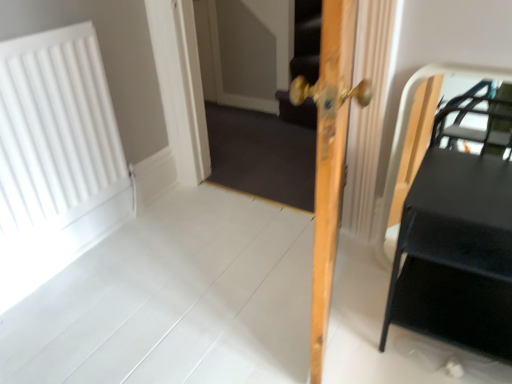
Question: Is white matte radiator at left positioned with its back to light wood door at center?

Choices:
 (A) yes
 (B) no

Answer: (B)

Question: From a real-world perspective, is white matte radiator at left over light wood door at center?

Choices:
 (A) yes
 (B) no

Answer: (B)

Question: Could you tell me if white matte radiator at left is facing light wood door at center?

Choices:
 (A) no
 (B) yes

Answer: (B)

Question: Can light wood door at center be found inside white matte radiator at left?

Choices:
 (A) yes
 (B) no

Answer: (B)

Question: From a real-world perspective, does white matte radiator at left sit lower than light wood door at center?

Choices:
 (A) yes
 (B) no

Answer: (A)

Question: Is point (204, 18) closer or farther from the camera than point (426, 183)?

Choices:
 (A) farther
 (B) closer

Answer: (A)

Question: From the image's perspective, is wooden screen door at center positioned above or below black matte table at right?

Choices:
 (A) below
 (B) above

Answer: (B)

Question: Considering the relative positions of wooden screen door at center and black matte table at right in the image provided, is wooden screen door at center to the left or to the right of black matte table at right?

Choices:
 (A) right
 (B) left

Answer: (B)

Question: From a real-world perspective, is wooden screen door at center above or below black matte table at right?

Choices:
 (A) above
 (B) below

Answer: (A)

Question: In the image, is light wood door at center positioned in front of or behind white matte radiator at left?

Choices:
 (A) front
 (B) behind

Answer: (A)

Question: Is light wood door at center to the left or to the right of white matte radiator at left in the image?

Choices:
 (A) left
 (B) right

Answer: (B)

Question: In terms of width, does light wood door at center look wider or thinner when compared to white matte radiator at left?

Choices:
 (A) wide
 (B) thin

Answer: (A)

Question: From the image's perspective, is light wood door at center located above or below white matte radiator at left?

Choices:
 (A) below
 (B) above

Answer: (A)

Question: In the image, is white matte radiator at left on the left side or the right side of black matte table at right?

Choices:
 (A) right
 (B) left

Answer: (B)

Question: Considering the positions of white matte radiator at left and black matte table at right in the image, is white matte radiator at left taller or shorter than black matte table at right?

Choices:
 (A) short
 (B) tall

Answer: (B)